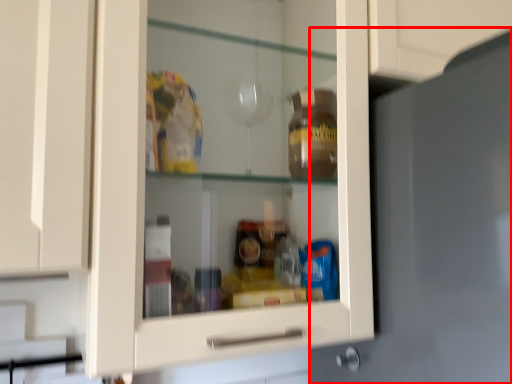
Question: Considering the relative positions of door (annotated by the red box) and knob in the image provided, where is door (annotated by the red box) located with respect to the staircase?

Choices:
 (A) right
 (B) left

Answer: (A)